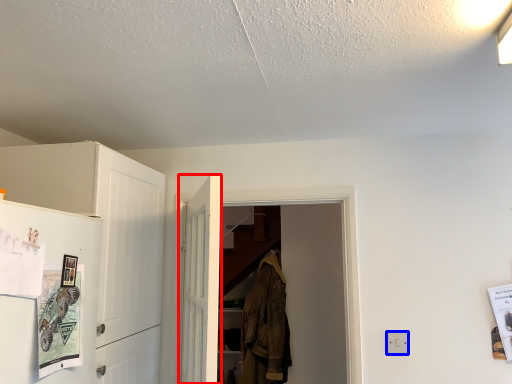
Question: Among these objects, which one is nearest to the camera, door (highlighted by a red box) or electric outlet (highlighted by a blue box)?

Choices:
 (A) door
 (B) electric outlet

Answer: (A)